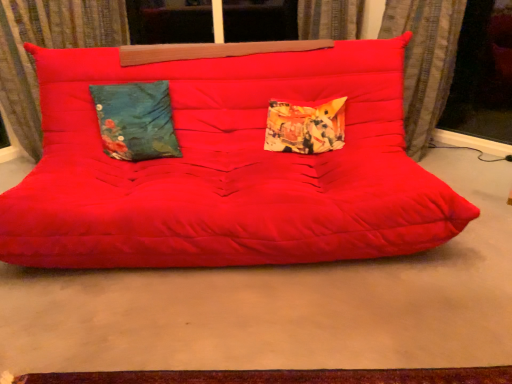
Measure the distance between textured fabric curtain at right, the second curtain from the left, and camera.

The depth of textured fabric curtain at right, the second curtain from the left, is 2.40 meters.

Measure the distance between point (122, 157) and camera.

Point (122, 157) is 2.20 meters from camera.

Measure the distance between point (106,5) and camera.

Point (106,5) is 2.65 meters away from camera.

In order to click on textured fabric curtain at right, the first curtain in the right-to-left sequence in this screenshot , I will do `click(424, 62)`.

From a real-world perspective, is printed fabric pillow at center, which appears as the 1th pillow when viewed from the right, on top of velvet curtain at upper left, placed as the 2th curtain when sorted from right to left?

No.

Is printed fabric pillow at center, which appears as the 1th pillow when viewed from the right, turned away from velvet curtain at upper left, placed as the 2th curtain when sorted from right to left?

No, printed fabric pillow at center, which appears as the 1th pillow when viewed from the right, is not facing the opposite direction of velvet curtain at upper left, placed as the 2th curtain when sorted from right to left.

Looking at this image, how distant is printed fabric pillow at center, which ranks as the 2th pillow in left-to-right order, from velvet curtain at upper left, placed as the 2th curtain when sorted from right to left?

4.57 feet.

In the scene shown: Considering the positions of objects printed fabric pillow at center, which appears as the 1th pillow when viewed from the right, and velvet curtain at upper left, placed as the 2th curtain when sorted from right to left, in the image provided, who is more to the left, printed fabric pillow at center, which appears as the 1th pillow when viewed from the right, or velvet curtain at upper left, placed as the 2th curtain when sorted from right to left,?

From the viewer's perspective, velvet curtain at upper left, placed as the 2th curtain when sorted from right to left, appears more on the left side.

Can we say transparent glass window screen at right lies outside teal floral fabric pillow at left, the first pillow when ordered from left to right?

Absolutely, transparent glass window screen at right is external to teal floral fabric pillow at left, the first pillow when ordered from left to right.

This screenshot has width=512, height=384. In order to click on the 1st pillow below the transparent glass window screen at right (from the image's perspective) in this screenshot , I will do `click(136, 121)`.

Which object is wider, transparent glass window screen at right or teal floral fabric pillow at left, acting as the second pillow starting from the right?

teal floral fabric pillow at left, acting as the second pillow starting from the right, is wider.

From a real-world perspective, is transparent glass window screen at right physically located above or below teal floral fabric pillow at left, the first pillow when ordered from left to right?

transparent glass window screen at right is below teal floral fabric pillow at left, the first pillow when ordered from left to right.

Is velvet curtain at upper left, the 1th curtain when ordered from left to right, wider or thinner than transparent glass window screen at right?

In the image, velvet curtain at upper left, the 1th curtain when ordered from left to right, appears to be wider than transparent glass window screen at right.

Considering the relative sizes of velvet curtain at upper left, placed as the 2th curtain when sorted from right to left, and transparent glass window screen at right in the image provided, is velvet curtain at upper left, placed as the 2th curtain when sorted from right to left, shorter than transparent glass window screen at right?

No, velvet curtain at upper left, placed as the 2th curtain when sorted from right to left, is not shorter than transparent glass window screen at right.

Is there a large distance between velvet curtain at upper left, the 1th curtain when ordered from left to right, and transparent glass window screen at right?

A: velvet curtain at upper left, the 1th curtain when ordered from left to right, is far away from transparent glass window screen at right.

Between printed fabric pillow at center, which ranks as the 2th pillow in left-to-right order, and transparent glass window screen at right, which one has smaller size?

Smaller between the two is printed fabric pillow at center, which ranks as the 2th pillow in left-to-right order.

Locate an element on the screen. This screenshot has height=384, width=512. the 2nd pillow below the transparent glass window screen at right (from the image's perspective) is located at coordinates (305, 127).

Between printed fabric pillow at center, which appears as the 1th pillow when viewed from the right, and transparent glass window screen at right, which one has less height?

With less height is printed fabric pillow at center, which appears as the 1th pillow when viewed from the right.

Is the surface of textured fabric curtain at right, the second curtain from the left, in direct contact with printed fabric pillow at center, which ranks as the 2th pillow in left-to-right order?

They are not placed beside each other.

From the textured fabric curtain at right, the first curtain in the right-to-left sequence, count the 1st pillow to the left and point to it. Please provide its 2D coordinates.

[(305, 127)]

Consider the image. Does textured fabric curtain at right, the first curtain in the right-to-left sequence, have a larger size compared to printed fabric pillow at center, which ranks as the 2th pillow in left-to-right order?

Indeed, textured fabric curtain at right, the first curtain in the right-to-left sequence, has a larger size compared to printed fabric pillow at center, which ranks as the 2th pillow in left-to-right order.

In the scene shown: Who is taller, textured fabric curtain at right, the second curtain from the left, or printed fabric pillow at center, which ranks as the 2th pillow in left-to-right order?

textured fabric curtain at right, the second curtain from the left, is taller.

Is point (236, 172) closer to viewer compared to point (486, 285)?

That is False.

Consider the image. Is matte red studio couch at center outside of matte red futon at center?

That's correct, matte red studio couch at center is outside of matte red futon at center.

From the image's perspective, which is above, matte red studio couch at center or matte red futon at center?

matte red studio couch at center is shown above in the image.

Is matte red studio couch at center positioned far away from matte red futon at center?

No, matte red studio couch at center is not far from matte red futon at center.

Which is less distant, (0, 67) or (332, 145)?

Point (0, 67) is farther from the camera than point (332, 145).

Is velvet curtain at upper left, placed as the 2th curtain when sorted from right to left, inside or outside of printed fabric pillow at center, which ranks as the 2th pillow in left-to-right order?

velvet curtain at upper left, placed as the 2th curtain when sorted from right to left, is not inside printed fabric pillow at center, which ranks as the 2th pillow in left-to-right order, it's outside.

Can you confirm if velvet curtain at upper left, the 1th curtain when ordered from left to right, is taller than printed fabric pillow at center, which appears as the 1th pillow when viewed from the right?

Indeed, velvet curtain at upper left, the 1th curtain when ordered from left to right, has a greater height compared to printed fabric pillow at center, which appears as the 1th pillow when viewed from the right.

From the picture: From a real-world perspective, is velvet curtain at upper left, placed as the 2th curtain when sorted from right to left, located beneath printed fabric pillow at center, which ranks as the 2th pillow in left-to-right order?

Actually, velvet curtain at upper left, placed as the 2th curtain when sorted from right to left, is physically above printed fabric pillow at center, which ranks as the 2th pillow in left-to-right order, in the real world.

Find the location of a particular element. the 2nd pillow counting from the right of the velvet curtain at upper left, the 1th curtain when ordered from left to right is located at coordinates (305, 127).

Image resolution: width=512 pixels, height=384 pixels. Find the location of `pillow that is above the transparent glass window screen at right (from a real-world perspective)`. pillow that is above the transparent glass window screen at right (from a real-world perspective) is located at coordinates (136, 121).

From the image, which object appears to be nearer to textured fabric curtain at right, the second curtain from the left, printed fabric pillow at center, which ranks as the 2th pillow in left-to-right order, or velvet curtain at upper left, placed as the 2th curtain when sorted from right to left?

Based on the image, printed fabric pillow at center, which ranks as the 2th pillow in left-to-right order, appears to be nearer to textured fabric curtain at right, the second curtain from the left.

Considering their positions, is matte red futon at center positioned closer to matte red studio couch at center than printed fabric pillow at center, which appears as the 1th pillow when viewed from the right?

printed fabric pillow at center, which appears as the 1th pillow when viewed from the right, is closer to matte red studio couch at center.

When comparing their distances from matte red studio couch at center, does matte red futon at center or transparent glass window screen at right seem closer?

matte red futon at center lies closer to matte red studio couch at center than the other object.

Based on their spatial positions, is textured fabric curtain at right, the first curtain in the right-to-left sequence, or printed fabric pillow at center, which appears as the 1th pillow when viewed from the right, closer to matte red futon at center?

The object closer to matte red futon at center is printed fabric pillow at center, which appears as the 1th pillow when viewed from the right.

Which object lies nearer to the anchor point velvet curtain at upper left, placed as the 2th curtain when sorted from right to left, teal floral fabric pillow at left, acting as the second pillow starting from the right, or printed fabric pillow at center, which ranks as the 2th pillow in left-to-right order?

Among the two, teal floral fabric pillow at left, acting as the second pillow starting from the right, is located nearer to velvet curtain at upper left, placed as the 2th curtain when sorted from right to left.

Considering their positions, is teal floral fabric pillow at left, the first pillow when ordered from left to right, positioned closer to printed fabric pillow at center, which ranks as the 2th pillow in left-to-right order, than textured fabric curtain at right, the first curtain in the right-to-left sequence?

The object closer to printed fabric pillow at center, which ranks as the 2th pillow in left-to-right order, is teal floral fabric pillow at left, the first pillow when ordered from left to right.

From the image, which object appears to be nearer to matte red studio couch at center, velvet curtain at upper left, placed as the 2th curtain when sorted from right to left, or teal floral fabric pillow at left, acting as the second pillow starting from the right?

teal floral fabric pillow at left, acting as the second pillow starting from the right.

Estimate the real-world distances between objects in this image. Which object is further from transparent glass window screen at right, matte red studio couch at center or printed fabric pillow at center, which ranks as the 2th pillow in left-to-right order?

matte red studio couch at center is positioned further to the anchor transparent glass window screen at right.

Locate an element on the screen. This screenshot has width=512, height=384. concrete situated between teal floral fabric pillow at left, the first pillow when ordered from left to right, and transparent glass window screen at right from left to right is located at coordinates (282, 305).

The width and height of the screenshot is (512, 384). I want to click on studio couch between velvet curtain at upper left, placed as the 2th curtain when sorted from right to left, and matte red futon at center, in the horizontal direction, so click(x=227, y=168).

At what (x,y) coordinates should I click in order to perform the action: click on studio couch between teal floral fabric pillow at left, acting as the second pillow starting from the right, and transparent glass window screen at right. Please return your answer as a coordinate pair (x, y). The width and height of the screenshot is (512, 384). Looking at the image, I should click on (227, 168).

You are a GUI agent. You are given a task and a screenshot of the screen. Output one action in this format:
    pyautogui.click(x=<x>, y=<y>)
    Task: Click on the concrete between matte red studio couch at center and transparent glass window screen at right in the horizontal direction
    
    Given the screenshot: What is the action you would take?
    pyautogui.click(x=282, y=305)